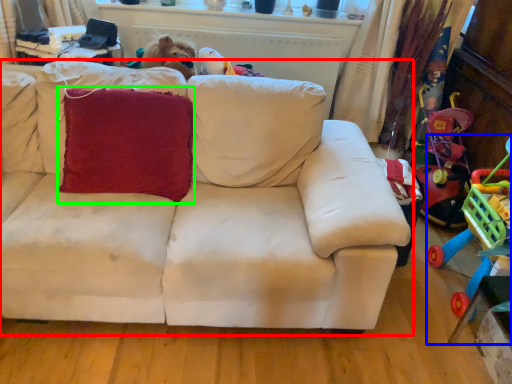
Question: Considering the real-world distances, which object is farthest from studio couch (highlighted by a red box)? toy (highlighted by a blue box) or throw pillow (highlighted by a green box)?

Choices:
 (A) toy
 (B) throw pillow

Answer: (A)